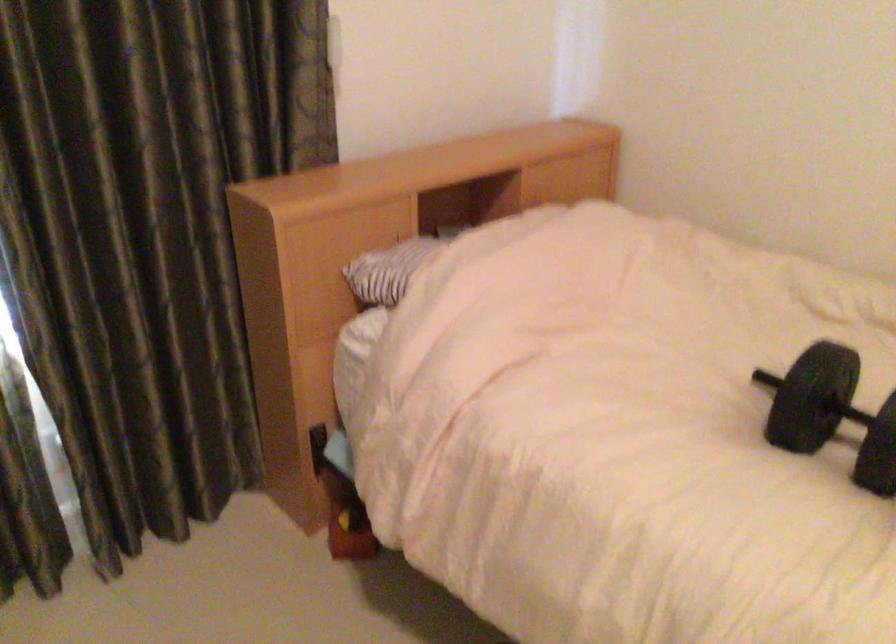
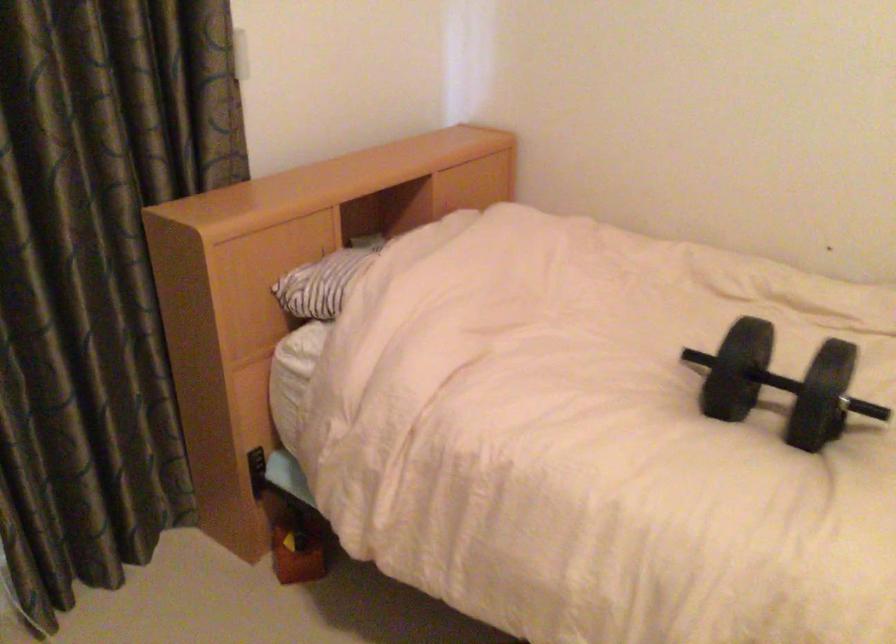
Question: The camera is either moving clockwise (left) or counter-clockwise (right) around the object. The first image is from the beginning of the video and the second image is from the end. Is the camera moving left or right when shooting the video?

Choices:
 (A) Left
 (B) Right

Answer: (A)